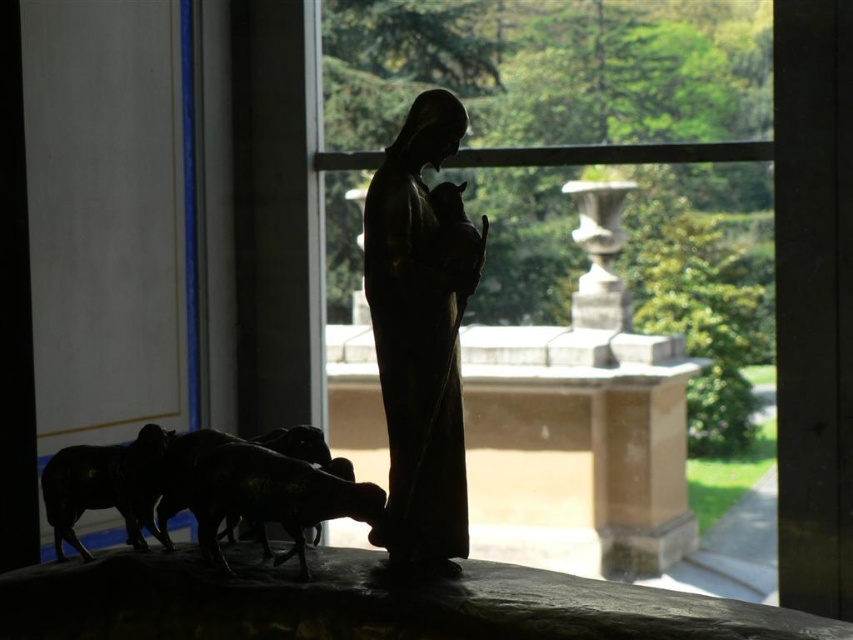
Between transparent glass window at center and dark matte metal sheep at lower left, which one is positioned higher?

transparent glass window at center is higher up.

Which is behind, point (561, 0) or point (195, 472)?

The point (561, 0) is more distant.

Does point (343, 264) come in front of point (355, 512)?

That is False.

Locate an element on the screen. This screenshot has width=853, height=640. transparent glass window at center is located at coordinates (612, 355).

Which is below, transparent glass window at center or matte black statue at center?

matte black statue at center is lower down.

Consider the image. Does transparent glass window at center appear under matte black statue at center?

No.

Does point (532, 8) come in front of point (437, 433)?

That is False.

At what (x,y) coordinates should I click in order to perform the action: click on transparent glass window at center. Please return your answer as a coordinate pair (x, y). Looking at the image, I should click on (612, 355).

Which of these two, transparent glass window at center or shiny black sheep at lower left, stands shorter?

Standing shorter between the two is shiny black sheep at lower left.

Is transparent glass window at center below shiny black sheep at lower left?

No.

Is point (590, 10) closer to viewer compared to point (148, 547)?

No.

Locate an element on the screen. Image resolution: width=853 pixels, height=640 pixels. transparent glass window at center is located at coordinates (612, 355).